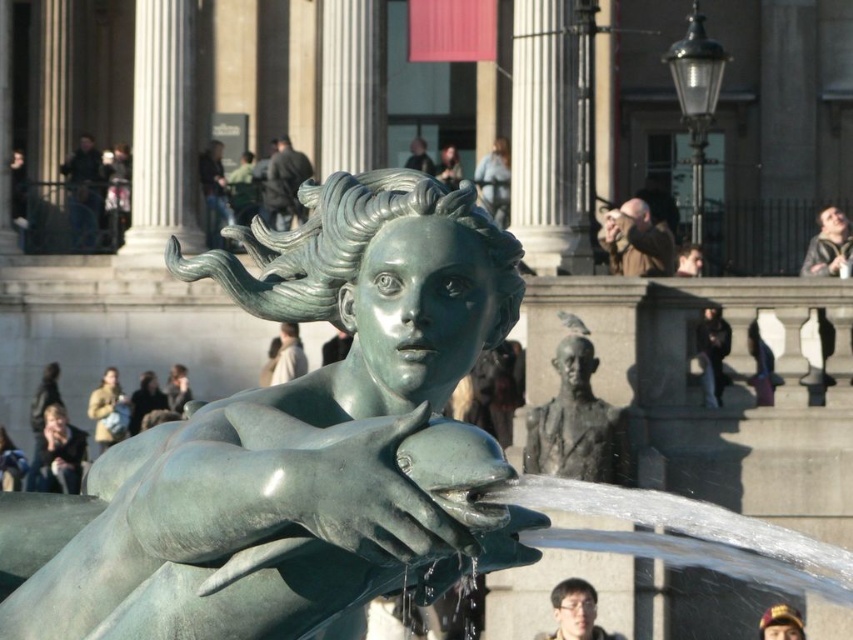
You are standing at the camera position and want to take a photo of the green patina statue at center. If your camera has a maximum focus range of 30 meters, will you be able to focus on the statue?

The green patina statue at center and camera are 34.11 meters apart from each other. Since the distance exceeds the camera maximum focus range of 30 meters, you won not be able to focus on the statue.

You are standing in the public square and want to take a photo of the statue. The statue is located at the center. There is a point marked at coordinates (299, 442). What does this point represent?

The point marked at coordinates (299, 442) represents the location of the green patina statue at center.

You are a photographer standing at the edge of the plaza. You want to capture a photo that includes both the green patina statue at center and the light brown hair at upper right. Given that your camera has a maximum zoom range of 50 meters, will you be able to fit both subjects into the frame without moving closer?

The distance between the green patina statue at center and the light brown hair at upper right is 59.13 meters. Since your camera can only zoom up to 50 meters, you will not be able to fit both subjects into the frame without moving closer.